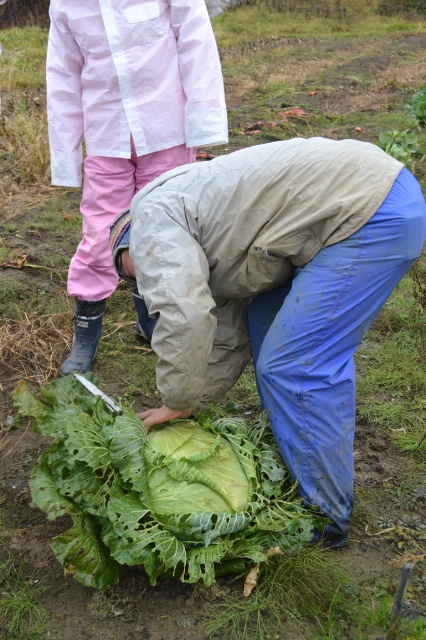
You are a gardener standing in the garden and want to reach the green leafy vegetable at center. The garden has a path that is 1.5 meters wide. Can you walk towards the vegetable and pick it without stepping off the path?

The green leafy vegetable at center is 1.84 meters from camera, so you can walk towards it as long as the path is wide enough. Since the path is 1.5 meters wide, which is narrower than the vegetable, you might need to adjust your path to stay within the 1.5 meter width while approaching it.

You are a farmer checking the crops in the garden. You see the green leafy vegetable at center and the green leafy cabbage at center. Which one is larger in size?

The green leafy vegetable at center is bigger than the green leafy cabbage at center.